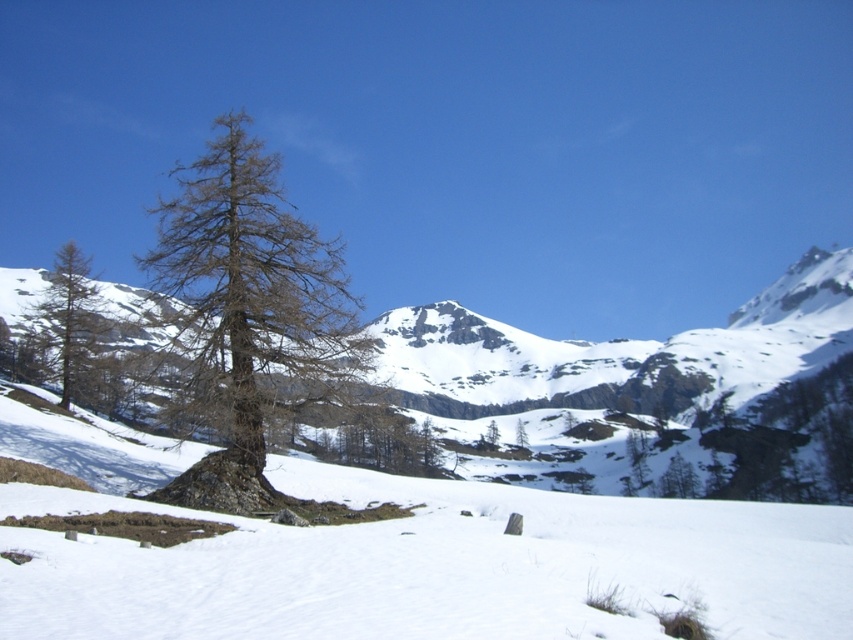
You are standing at the base of the central tree and want to walk to the point marked by point (x=323, y=348) and then to point (x=80, y=392). Which path will require you to walk further away from the central tree?

The path to point (x=80, y=392) will require walking further away from the central tree because it is farther from the viewer compared to point (x=323, y=348).